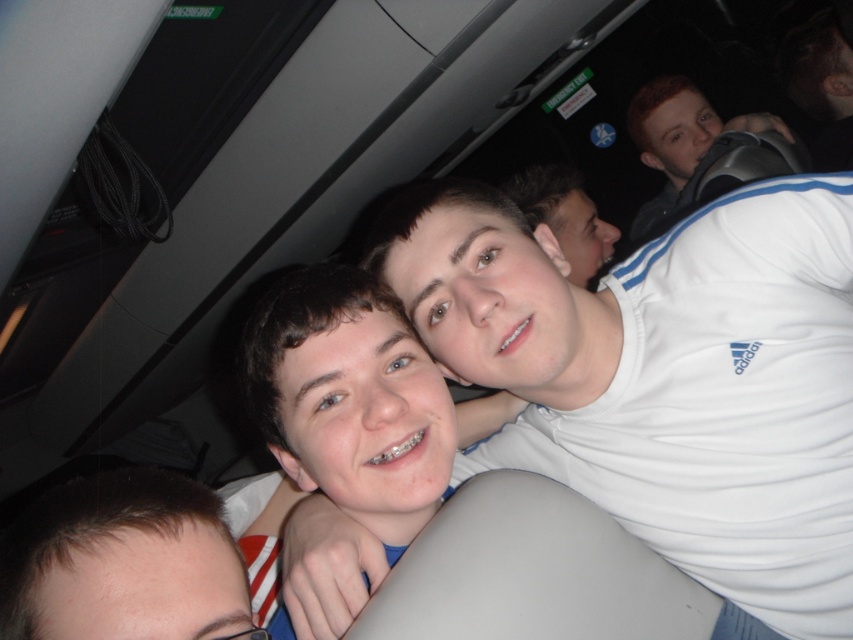
Who is positioned more to the right, smooth skin face at center or brown hair at lower left?

From the viewer's perspective, smooth skin face at center appears more on the right side.

What do you see at coordinates (350, 397) in the screenshot? The width and height of the screenshot is (853, 640). I see `smooth skin face at center` at bounding box center [350, 397].

Who is more distant from viewer, (404, 330) or (157, 577)?

Positioned behind is point (404, 330).

The image size is (853, 640). Find the location of `smooth skin face at center`. smooth skin face at center is located at coordinates (350, 397).

Identify the location of smooth skin face at center. This screenshot has height=640, width=853. (350, 397).

Which is behind, point (454, 417) or point (668, 188)?

The point (668, 188) is more distant.

Locate an element on the screen. This screenshot has width=853, height=640. smooth skin face at center is located at coordinates (350, 397).

This screenshot has height=640, width=853. Identify the location of smooth skin face at center. (350, 397).

Can you confirm if brown hair at lower left is smaller than matte black backpack at upper right?

Yes.

I want to click on brown hair at lower left, so click(x=120, y=561).

Who is more forward, (128, 481) or (695, 180)?

Point (128, 481) is in front.

Find the location of a particular element. This screenshot has width=853, height=640. brown hair at lower left is located at coordinates (120, 561).